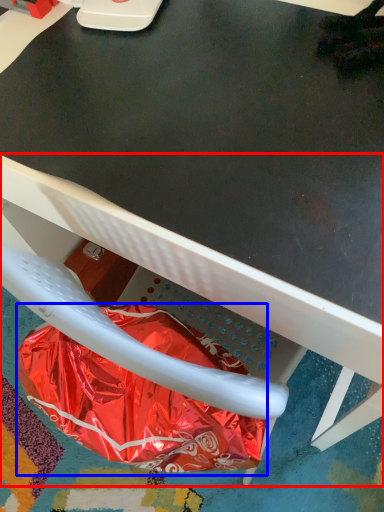
Question: Which of the following is the closest to the observer, chair (highlighted by a red box) or paper bag (highlighted by a blue box)?

Choices:
 (A) chair
 (B) paper bag

Answer: (A)